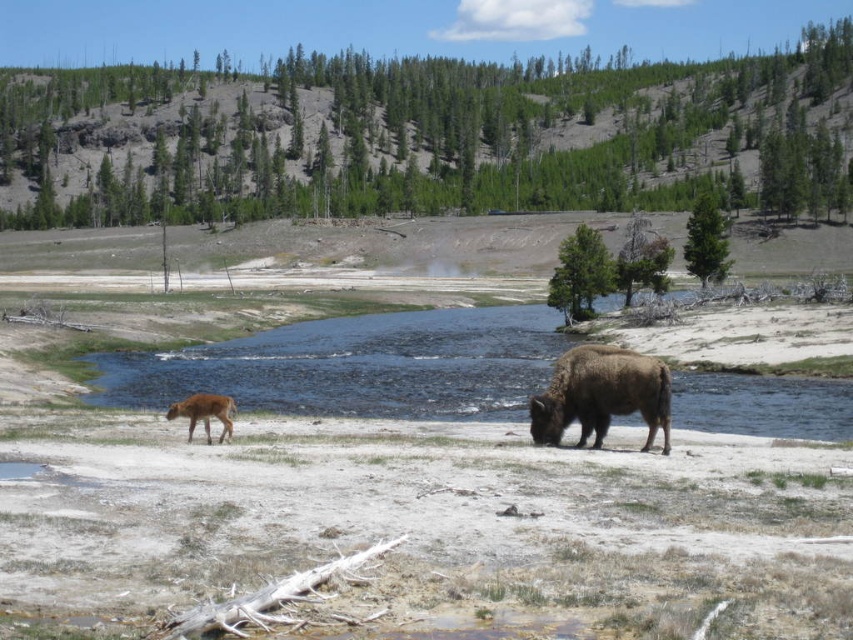
Question: Is brown furry yak at lower right behind brown fur at lower left?

Choices:
 (A) yes
 (B) no

Answer: (B)

Question: Which of the following is the farthest from the observer?

Choices:
 (A) (599, 353)
 (B) (218, 410)

Answer: (A)

Question: Is brown furry yak at lower right to the right of brown fur at lower left from the viewer's perspective?

Choices:
 (A) yes
 (B) no

Answer: (A)

Question: Is brown furry yak at lower right above brown fur at lower left?

Choices:
 (A) no
 (B) yes

Answer: (B)

Question: Which point is closer to the camera taking this photo?

Choices:
 (A) (189, 426)
 (B) (584, 396)

Answer: (B)